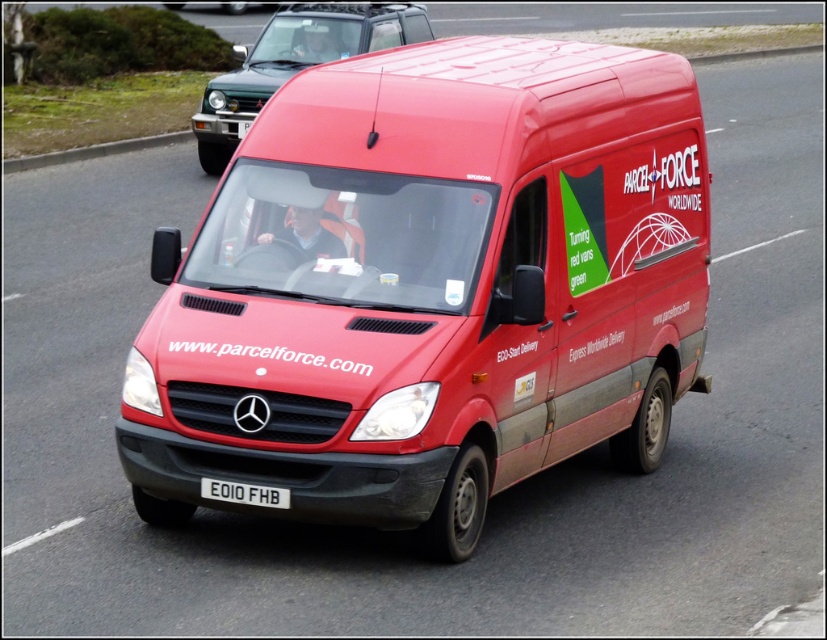
Which is more to the right, matte red van at center or white metallic license plate at center?

matte red van at center

In the scene shown: Who is lower down, matte red van at center or white metallic license plate at center?

Positioned lower is white metallic license plate at center.

This screenshot has width=827, height=640. What are the coordinates of `matte red van at center` in the screenshot? It's located at (429, 288).

At what (x,y) coordinates should I click in order to perform the action: click on matte red van at center. Please return your answer as a coordinate pair (x, y). Looking at the image, I should click on (429, 288).

Who is taller, metallic green suv at upper left or white metallic license plate at center?

metallic green suv at upper left is taller.

Is point (338, 54) farther from viewer compared to point (232, 486)?

Yes, it is.

Describe the element at coordinates (294, 61) in the screenshot. I see `metallic green suv at upper left` at that location.

Locate an element on the screen. The width and height of the screenshot is (827, 640). metallic green suv at upper left is located at coordinates (294, 61).

Does matte red van at center appear on the left side of metallic green suv at upper left?

In fact, matte red van at center is to the right of metallic green suv at upper left.

Does point (462, 472) lie behind point (240, 84)?

No, (462, 472) is closer to viewer.

Who is more forward, (257,216) or (227,86)?

Point (257,216) is in front.

Locate an element on the screen. The width and height of the screenshot is (827, 640). matte red van at center is located at coordinates (429, 288).